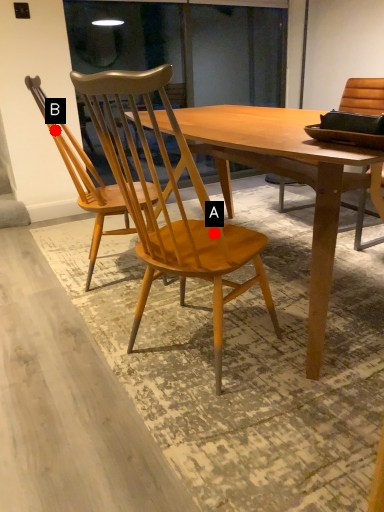
Question: Two points are circled on the image, labeled by A and B beside each circle. Which point is further to the camera?

Choices:
 (A) A is further
 (B) B is further

Answer: (B)